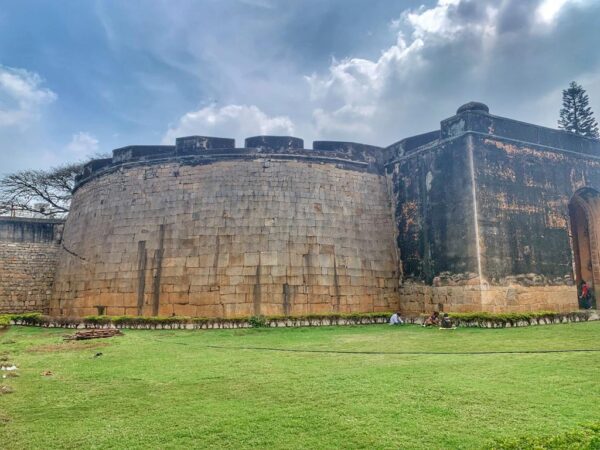
At what (x,y) coordinates should I click in order to perform the action: click on black wall. Please return your answer as a coordinate pair (x, y). The height and width of the screenshot is (450, 600). Looking at the image, I should click on (421, 242), (527, 240).